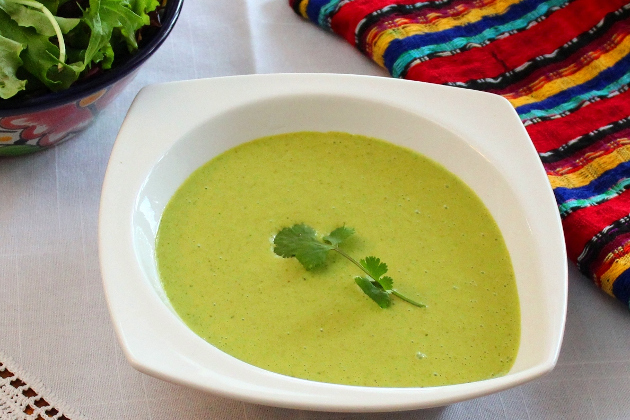
Locate an element on the screen. table cloth is located at coordinates (40, 281).